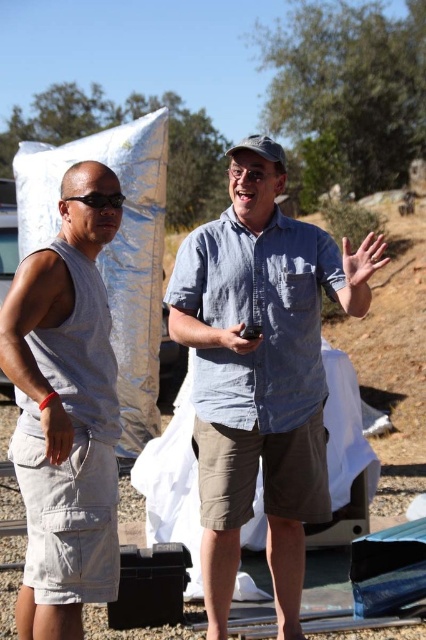
You are a photographer trying to capture a candid shot of both the blue linen shirt at center and the gray fabric wristband at lower left. Since you want both subjects to be in the frame, which direction should you move your camera to ensure both are visible?

The blue linen shirt at center is to the right of gray fabric wristband at lower left, so you should move your camera to the left to include both the blue linen shirt at center and the gray fabric wristband at lower left in the frame.

You are trying to decide whether to place a new accessory on the gray fabric wristband at lower left or the matte black phone at center. Which object has a smaller width?

The gray fabric wristband at lower left has a smaller width than the matte black phone at center.

You are a fashion designer observing two people in the image. The blue linen shirt at center and the gray fabric wristband at lower left are part of their outfits. Which clothing item is positioned higher up on the body?

The blue linen shirt at center is located above the gray fabric wristband at lower left, so it is positioned higher up on the body.